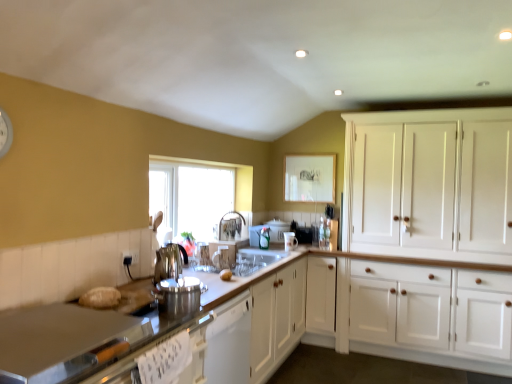
Where is `vacant area that lies to the right of bread matte at center`? vacant area that lies to the right of bread matte at center is located at coordinates pyautogui.click(x=244, y=274).